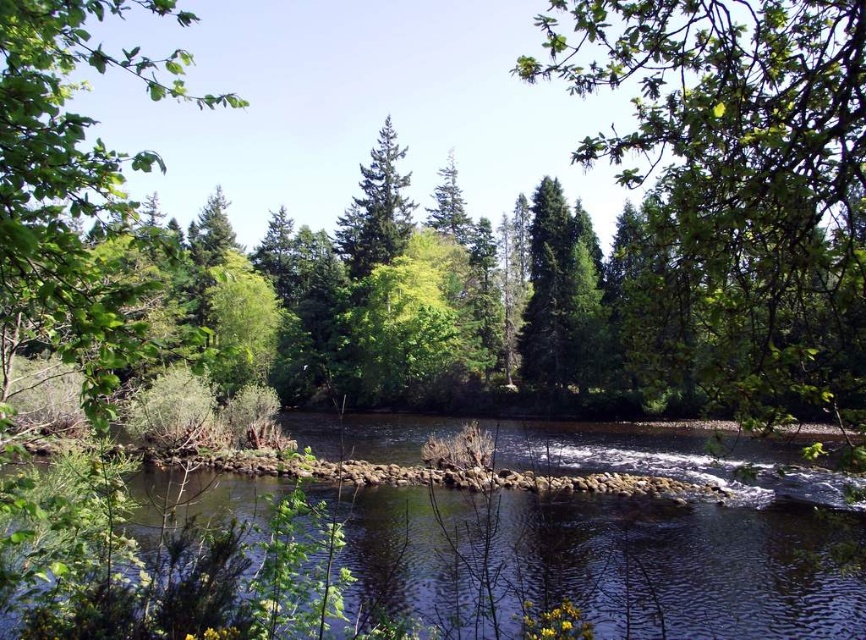
Question: Which point is closer to the camera taking this photo?

Choices:
 (A) (182, 58)
 (B) (472, 608)
 (C) (805, 35)

Answer: (A)

Question: Does green leafy tree at upper right appear over smooth stone river at center?

Choices:
 (A) no
 (B) yes

Answer: (B)

Question: Can you confirm if green leafy tree at upper right is bigger than green leafy tree at left?

Choices:
 (A) yes
 (B) no

Answer: (B)

Question: Based on their relative distances, which object is nearer to the green leafy tree at upper right?

Choices:
 (A) smooth stone river at center
 (B) green textured pine tree at center

Answer: (A)

Question: Is smooth stone river at center to the left of green leafy tree at left from the viewer's perspective?

Choices:
 (A) no
 (B) yes

Answer: (A)

Question: Which of these objects is positioned closest to the green leafy tree at left?

Choices:
 (A) smooth stone river at center
 (B) green leafy tree at upper right

Answer: (A)